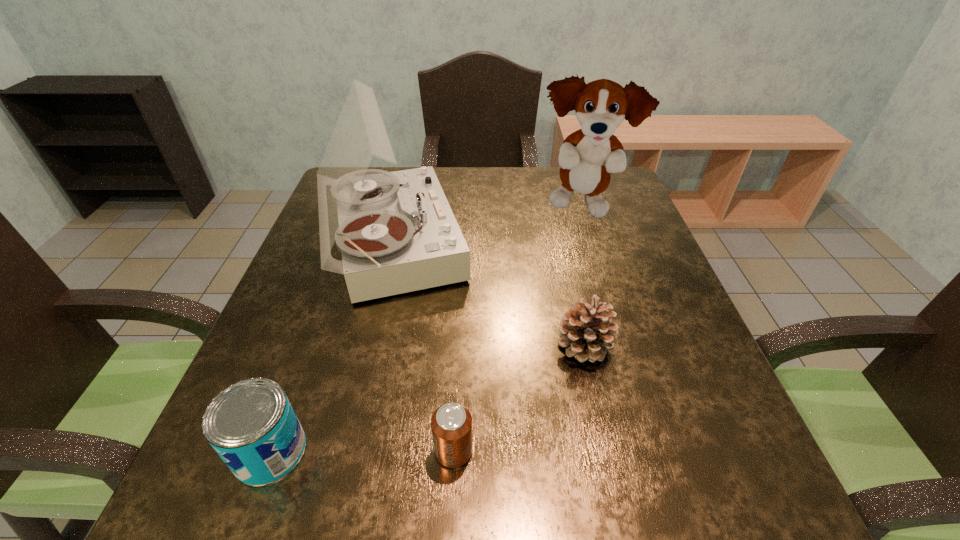
The image size is (960, 540). What are the coordinates of `free space between the record player and the shorter can` in the screenshot? It's located at (422, 347).

Identify the location of free point between the shortest object and the puppy. (516, 329).

I want to click on free point between the puppy and the record player, so click(x=486, y=226).

You are a GUI agent. You are given a task and a screenshot of the screen. Output one action in this format:
    pyautogui.click(x=<x>, y=<y>)
    Task: Click on the blank region between the record player and the left can
    This screenshot has height=540, width=960.
    Given the screenshot: What is the action you would take?
    pyautogui.click(x=331, y=347)

Where is `object that is the fourth closest to the third farthest object`? The height and width of the screenshot is (540, 960). object that is the fourth closest to the third farthest object is located at coordinates (252, 426).

Identify which object is the third nearest to the record player. Please provide its 2D coordinates. Your answer should be formatted as a tuple, i.e. [(x, y)], where the tuple contains the x and y coordinates of a point satisfying the conditions above.

[(252, 426)]

I want to click on free point that satisfies the following two spatial constraints: 1. on the back side of the left can; 2. on the right side of the record player, so click(x=346, y=244).

Identify the location of free location that satisfies the following two spatial constraints: 1. on the back side of the left can; 2. on the right side of the shortest object. (270, 450).

Locate an element on the screen. Image resolution: width=960 pixels, height=540 pixels. blank space that satisfies the following two spatial constraints: 1. on the front side of the third farthest object; 2. on the right side of the record player is located at coordinates (367, 346).